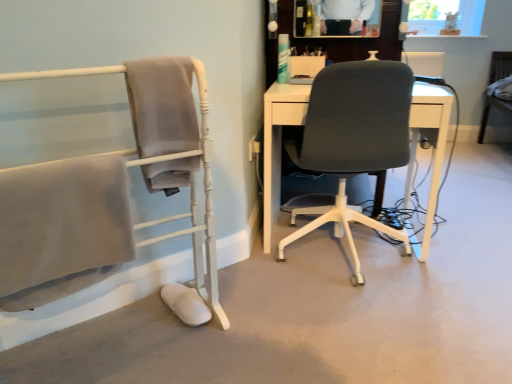
Question: Considering the relative sizes of matte gray chair at left, the first chair viewed from the front, and dark gray fabric office chair at center, which is the second chair in front-to-back order, in the image provided, is matte gray chair at left, the first chair viewed from the front, taller than dark gray fabric office chair at center, which is the second chair in front-to-back order,?

Choices:
 (A) no
 (B) yes

Answer: (B)

Question: Is matte gray chair at left, positioned as the third chair in back-to-front order, thinner than dark gray fabric office chair at center, which is the second chair in front-to-back order?

Choices:
 (A) yes
 (B) no

Answer: (A)

Question: Considering the relative positions of matte gray chair at left, the first chair viewed from the front, and dark gray fabric office chair at center, the second chair positioned from the right, in the image provided, is matte gray chair at left, the first chair viewed from the front, in front of dark gray fabric office chair at center, the second chair positioned from the right,?

Choices:
 (A) no
 (B) yes

Answer: (B)

Question: Is matte gray chair at left, the first chair viewed from the front, wider than dark gray fabric office chair at center, which is the second chair in back-to-front order?

Choices:
 (A) yes
 (B) no

Answer: (B)

Question: Considering the relative positions of matte gray chair at left, which is the first chair in left-to-right order, and dark gray fabric office chair at center, which is the second chair in front-to-back order, in the image provided, is matte gray chair at left, which is the first chair in left-to-right order, to the right of dark gray fabric office chair at center, which is the second chair in front-to-back order, from the viewer's perspective?

Choices:
 (A) yes
 (B) no

Answer: (B)

Question: Is matte gray chair at left, the first chair viewed from the front, positioned beyond the bounds of dark gray fabric office chair at center, the second chair positioned from the right?

Choices:
 (A) yes
 (B) no

Answer: (A)

Question: Considering the relative sizes of wooden chair at right, marked as the third chair in a left-to-right arrangement, and matte gray chair at left, positioned as the third chair in back-to-front order, in the image provided, is wooden chair at right, marked as the third chair in a left-to-right arrangement, shorter than matte gray chair at left, positioned as the third chair in back-to-front order,?

Choices:
 (A) no
 (B) yes

Answer: (B)

Question: From the image's perspective, would you say wooden chair at right, the first chair viewed from the back, is positioned over matte gray chair at left, positioned as the third chair in back-to-front order?

Choices:
 (A) yes
 (B) no

Answer: (A)

Question: Is wooden chair at right, the first chair viewed from the back, positioned in front of matte gray chair at left, which appears as the third chair when viewed from the right?

Choices:
 (A) yes
 (B) no

Answer: (B)

Question: Considering the relative positions of wooden chair at right, the third chair when ordered from front to back, and matte gray chair at left, which is the first chair in left-to-right order, in the image provided, is wooden chair at right, the third chair when ordered from front to back, to the right of matte gray chair at left, which is the first chair in left-to-right order, from the viewer's perspective?

Choices:
 (A) yes
 (B) no

Answer: (A)

Question: Is wooden chair at right, placed as the 1th chair when sorted from right to left, completely or partially outside of matte gray chair at left, which is the first chair in left-to-right order?

Choices:
 (A) yes
 (B) no

Answer: (A)

Question: From a real-world perspective, is wooden chair at right, the third chair when ordered from front to back, located higher than matte gray chair at left, which is the first chair in left-to-right order?

Choices:
 (A) no
 (B) yes

Answer: (A)

Question: Is dark gray fabric office chair at center, which is the second chair in front-to-back order, behind wooden chair at right, marked as the third chair in a left-to-right arrangement?

Choices:
 (A) yes
 (B) no

Answer: (B)